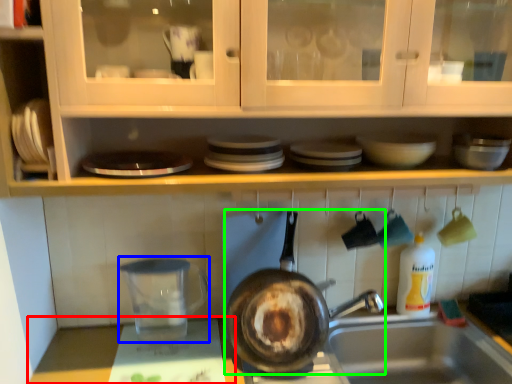
Question: Considering the real-world distances, which object is closest to counter top (highlighted by a red box)? appliance (highlighted by a blue box) or frying pan (highlighted by a green box).

Choices:
 (A) appliance
 (B) frying pan

Answer: (A)